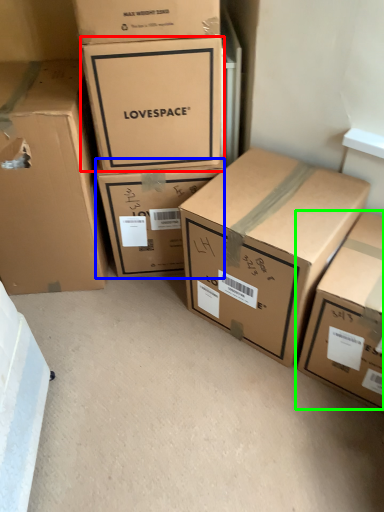
Question: Considering the real-world distances, which object is farthest from box (highlighted by a red box)? box (highlighted by a blue box) or box (highlighted by a green box)?

Choices:
 (A) box
 (B) box

Answer: (B)